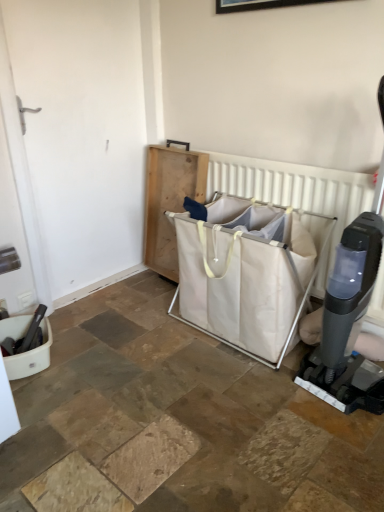
This screenshot has height=512, width=384. Describe the element at coordinates (169, 201) in the screenshot. I see `light brown wooden tray at center` at that location.

Measure the distance between point (215,320) and camera.

A distance of 1.95 meters exists between point (215,320) and camera.

Where is `light brown wooden tray at center`? This screenshot has height=512, width=384. light brown wooden tray at center is located at coordinates (169, 201).

Can you see white fabric laundry basket at center touching white fabric laundry basket at center?

No, white fabric laundry basket at center is not with white fabric laundry basket at center.

Considering the positions of point (280, 261) and point (224, 182), is point (280, 261) closer or farther from the camera than point (224, 182)?

Clearly, point (280, 261) is closer to the camera than point (224, 182).

Considering the positions of objects white fabric laundry basket at center and white fabric laundry basket at center in the image provided, who is more to the right, white fabric laundry basket at center or white fabric laundry basket at center?

Positioned to the right is white fabric laundry basket at center.

Can you confirm if white fabric laundry basket at center is shorter than white fabric laundry basket at center?

Indeed, white fabric laundry basket at center has a lesser height compared to white fabric laundry basket at center.

Are light brown wooden tray at center and white fabric laundry basket at center beside each other?

There is a gap between light brown wooden tray at center and white fabric laundry basket at center.

Is light brown wooden tray at center to the left or to the right of white fabric laundry basket at center in the image?

light brown wooden tray at center is to the left of white fabric laundry basket at center.

Is light brown wooden tray at center facing away from white fabric laundry basket at center?

No, light brown wooden tray at center is not facing the opposite direction of white fabric laundry basket at center.

Who is bigger, light brown wooden tray at center or white fabric laundry basket at center?

white fabric laundry basket at center is bigger.

From a real-world perspective, which object stands above the other?

white fabric laundry basket at center is physically above.

Measure the distance between white fabric laundry basket at center and light brown wooden tray at center.

white fabric laundry basket at center is 15.14 inches from light brown wooden tray at center.

From the picture: In terms of width, does white fabric laundry basket at center look wider or thinner when compared to light brown wooden tray at center?

Clearly, white fabric laundry basket at center has less width compared to light brown wooden tray at center.

Could you tell me if white fabric laundry basket at center is turned towards white fabric laundry basket at center?

Yes, white fabric laundry basket at center faces towards white fabric laundry basket at center.

Is white fabric laundry basket at center completely or partially inside white fabric laundry basket at center?

No, white fabric laundry basket at center does not contain white fabric laundry basket at center.

Which of these two, white fabric laundry basket at center or white fabric laundry basket at center, is bigger?

With larger size is white fabric laundry basket at center.

Can you tell me how much light brown wooden tray at center and white fabric laundry basket at center differ in facing direction?

The angle between the facing direction of light brown wooden tray at center and the facing direction of white fabric laundry basket at center is 3.16 degrees.

Is white fabric laundry basket at center surrounded by light brown wooden tray at center?

That's incorrect, white fabric laundry basket at center is not inside light brown wooden tray at center.

From the image's perspective, between light brown wooden tray at center and white fabric laundry basket at center, who is located below?

From the image's view, white fabric laundry basket at center is below.

Image resolution: width=384 pixels, height=512 pixels. Identify the location of baby carriage on the right of light brown wooden tray at center. (246, 274).

Would you say white fabric laundry basket at center is to the left or to the right of light brown wooden tray at center in the picture?

white fabric laundry basket at center is positioned on light brown wooden tray at center's right side.

Is white fabric laundry basket at center beside light brown wooden tray at center?

white fabric laundry basket at center is not next to light brown wooden tray at center, and they're not touching.

Considering the positions of points (239, 343) and (165, 221), is point (239, 343) farther from camera compared to point (165, 221)?

No.

You are a GUI agent. You are given a task and a screenshot of the screen. Output one action in this format:
    pyautogui.click(x=<x>, y=<y>)
    Task: Click on the radiator that is on the right side of white fabric laundry basket at center
    This screenshot has width=384, height=512.
    Given the screenshot: What is the action you would take?
    [x=295, y=192]

Where is `furniture that is on the left side of white fabric laundry basket at center`? furniture that is on the left side of white fabric laundry basket at center is located at coordinates (169, 201).

Looking at this image, considering their positions, is light brown wooden tray at center positioned further to white fabric laundry basket at center than white fabric laundry basket at center?

Among the two, light brown wooden tray at center is located further to white fabric laundry basket at center.

Estimate the real-world distances between objects in this image. Which object is further from white fabric laundry basket at center, white fabric laundry basket at center or light brown wooden tray at center?

The object further to white fabric laundry basket at center is light brown wooden tray at center.

Considering their positions, is light brown wooden tray at center positioned further to white fabric laundry basket at center than white fabric laundry basket at center?

light brown wooden tray at center is positioned further to the anchor white fabric laundry basket at center.

In the scene shown: Based on their spatial positions, is white fabric laundry basket at center or light brown wooden tray at center further from white fabric laundry basket at center?

light brown wooden tray at center is positioned further to the anchor white fabric laundry basket at center.

Estimate the real-world distances between objects in this image. Which object is further from light brown wooden tray at center, white fabric laundry basket at center or white fabric laundry basket at center?

white fabric laundry basket at center lies further to light brown wooden tray at center than the other object.

Looking at the image, which one is located further to light brown wooden tray at center, white fabric laundry basket at center or white fabric laundry basket at center?

white fabric laundry basket at center lies further to light brown wooden tray at center than the other object.

Identify the location of radiator between white fabric laundry basket at center and light brown wooden tray at center from front to back. Image resolution: width=384 pixels, height=512 pixels. (295, 192).